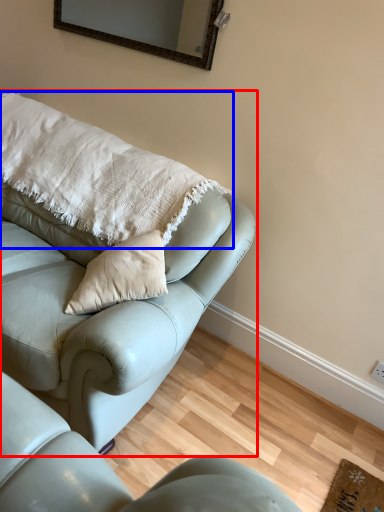
Question: Which object is closer to the camera taking this photo, studio couch (highlighted by a red box) or pillow (highlighted by a blue box)?

Choices:
 (A) studio couch
 (B) pillow

Answer: (A)